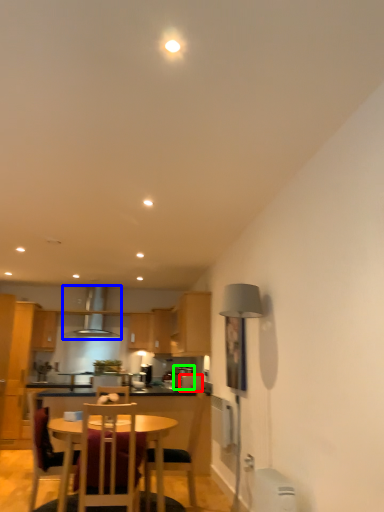
Question: Based on their relative distances, which object is nearer to appliance (highlighted by a red box)? Choose from exhaust hood (highlighted by a blue box) and appliance (highlighted by a green box).

Choices:
 (A) exhaust hood
 (B) appliance

Answer: (B)